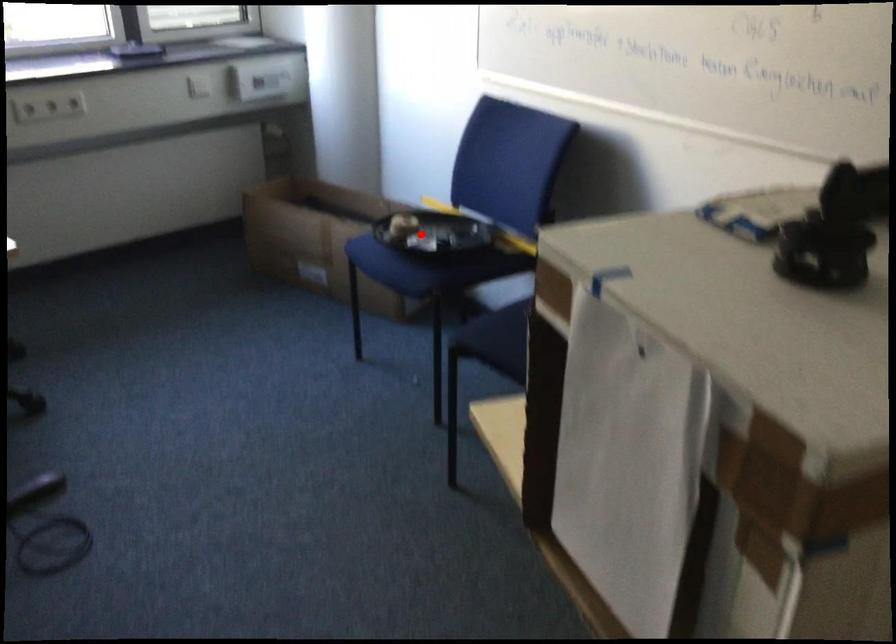
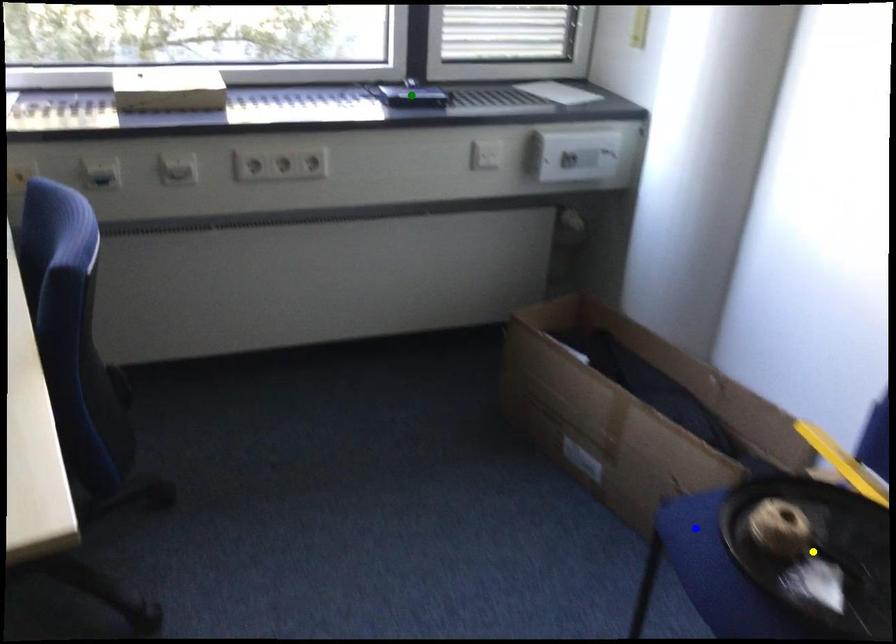
Question: I am providing you with two images of the same scene from different viewpoints. A red point is marked on the first image. You are given multiple points on the second image. Which mark in image 2 goes with the point in image 1?

Choices:
 (A) yellow point
 (B) blue point
 (C) green point

Answer: (A)